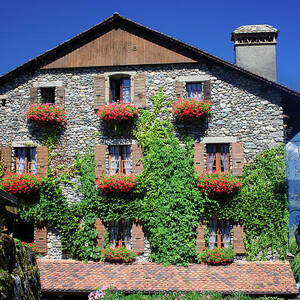
You are a GUI agent. You are given a task and a screenshot of the screen. Output one action in this format:
    pyautogui.click(x=<x>, y=<y>)
    Task: Click on the plant
    The width and height of the screenshot is (300, 300).
    Given the screenshot: What is the action you would take?
    pyautogui.click(x=226, y=254)